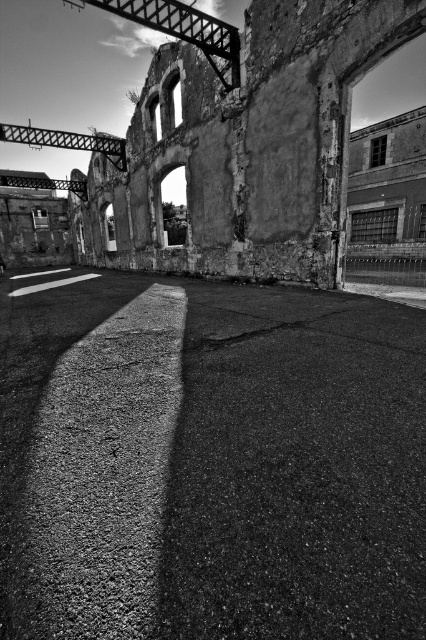
Based on the photo, you are a construction worker assessing the site. You notice the asphalt at center and the rough concrete ruins at center. Which of these two areas has a narrower width?

The asphalt at center has a lesser width compared to the rough concrete ruins at center, so the asphalt at center is narrower.